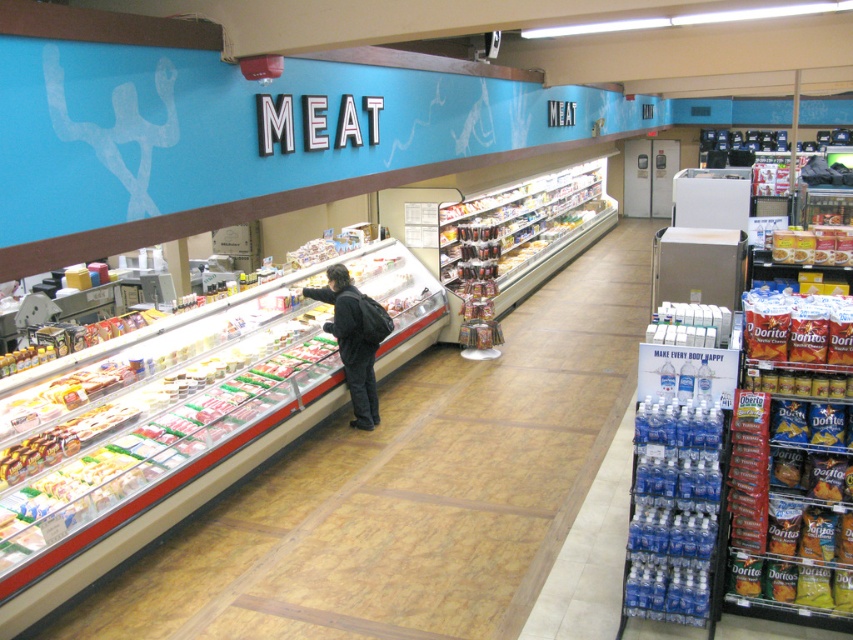
Which is below, clear plastic deli case at center or dark gray backpack at center?

Positioned lower is clear plastic deli case at center.

Does clear plastic deli case at center have a smaller size compared to dark gray backpack at center?

Incorrect, clear plastic deli case at center is not smaller in size than dark gray backpack at center.

Between point (543, 296) and point (305, 289), which one is positioned behind?

Positioned behind is point (543, 296).

This screenshot has height=640, width=853. Identify the location of clear plastic deli case at center. (408, 490).